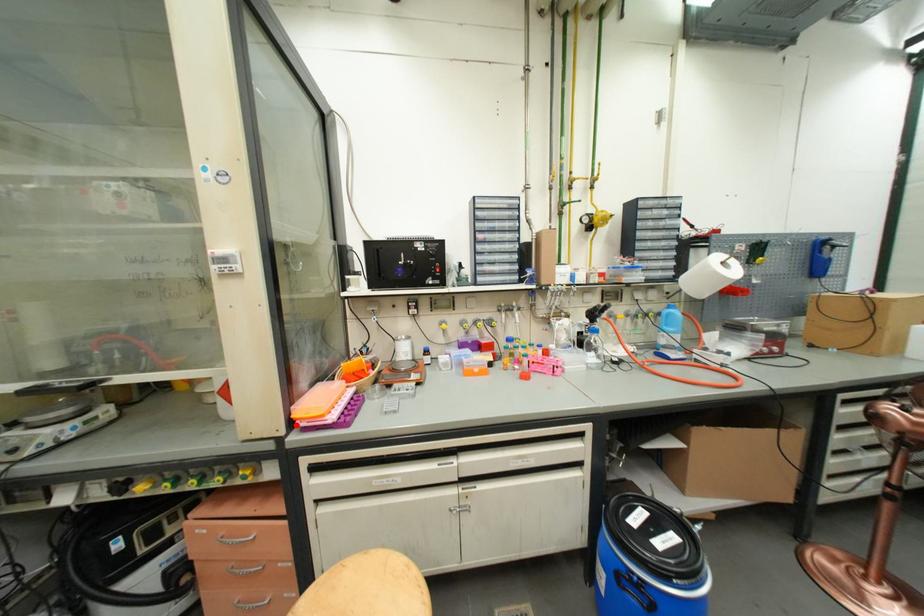
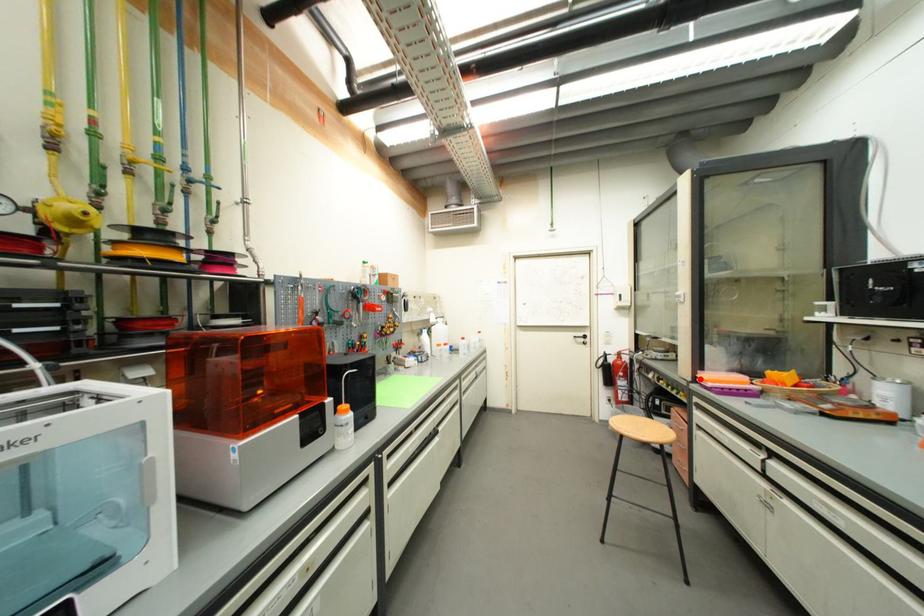
I am providing you with two images of the same scene from different viewpoints. A red point is marked on the first image and another point is marked on the second image. Do the highlighted points in image1 and image2 indicate the same real-world spot?

Yes